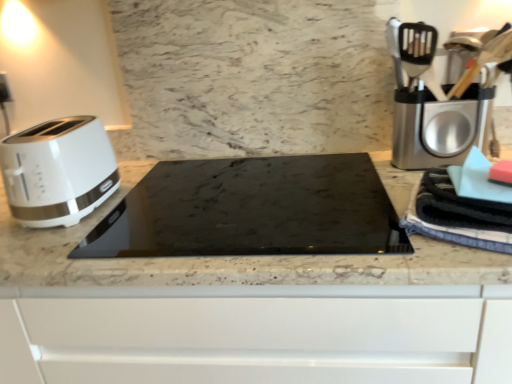
At what (x,y) coordinates should I click in order to perform the action: click on vacant region to the left of silver metallic coffee machine at right. Please return your answer as a coordinate pair (x, y). Looking at the image, I should click on (330, 185).